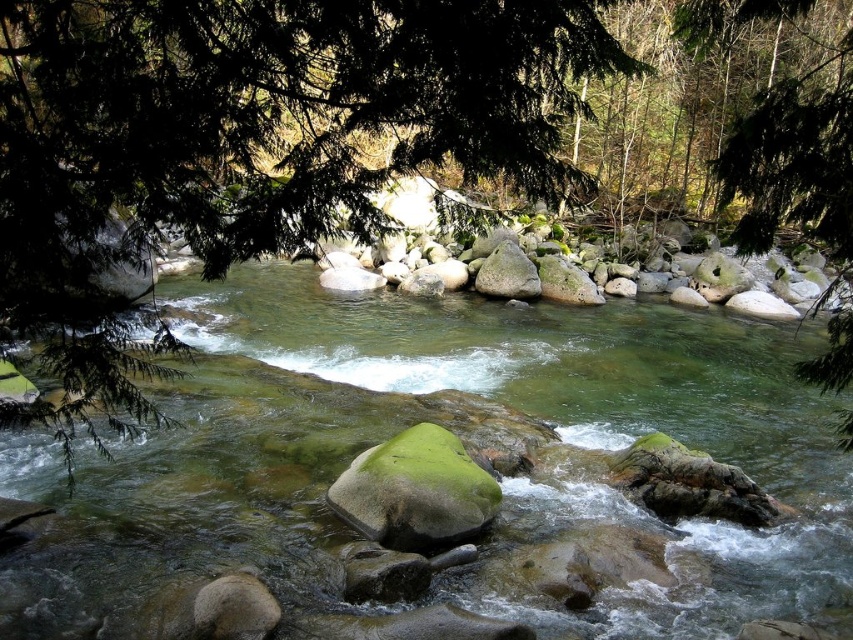
You are standing at the origin point of the coordinate system in the image. You want to reach the translucent green water at center. Which direction should you move in to get there?

You should move towards the coordinate point (459, 436) to reach the translucent green water at center.

You are a hiker standing at the edge of the river and want to cross it. You see the translucent green water at center and the green leafy tree at upper left. Which object is wider from your perspective?

The translucent green water at center is wider than the green leafy tree at upper left.

You are standing at the edge of the river and see the green mossy rock at center and the smooth gray rock at center. Which rock is closer to your left side?

The green mossy rock at center is to the left of smooth gray rock at center, so it is closer to your left side.